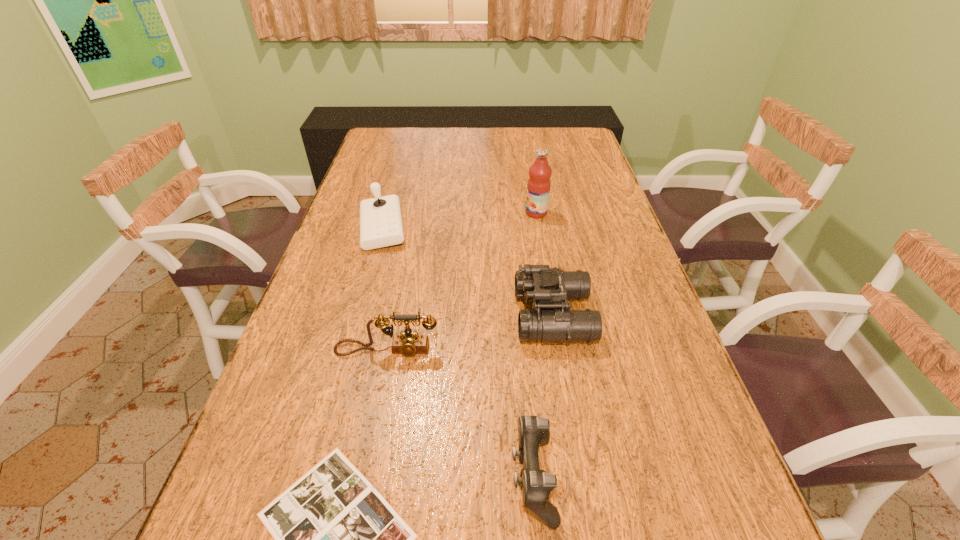
I want to click on vacant space located through the lenses of the binoculars, so point(479,316).

Where is `vacant position located 0.260m on the back of the joystick`? The height and width of the screenshot is (540, 960). vacant position located 0.260m on the back of the joystick is located at coordinates (399, 167).

I want to click on blank area located on the front-facing side of the telephone, so click(x=371, y=431).

The width and height of the screenshot is (960, 540). Find the location of `free space located 0.170m on the surface of the control with buttons`. free space located 0.170m on the surface of the control with buttons is located at coordinates (414, 477).

Locate an element on the screen. This screenshot has height=540, width=960. vacant region located on the surface of the control with buttons is located at coordinates (356, 477).

Locate an element on the screen. Image resolution: width=960 pixels, height=540 pixels. free spot located 0.330m on the surface of the control with buttons is located at coordinates (322, 477).

In order to click on joystick that is positioned at the left edge in this screenshot , I will do `click(381, 225)`.

Identify the location of telephone at the left edge. (408, 343).

This screenshot has width=960, height=540. In order to click on free space at the far edge of the desktop in this screenshot , I will do `click(483, 154)`.

Where is `vacant space at the left edge of the desktop`? The height and width of the screenshot is (540, 960). vacant space at the left edge of the desktop is located at coordinates (216, 528).